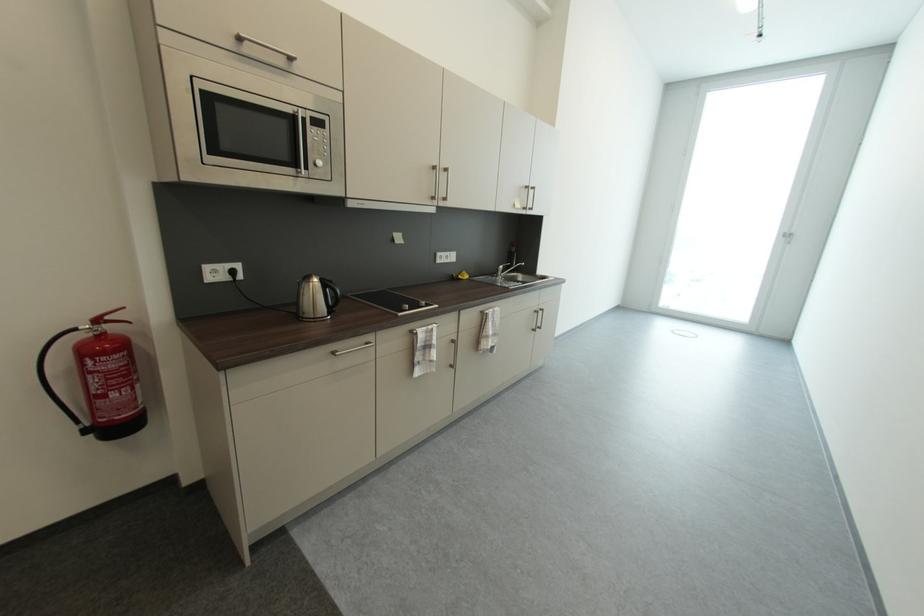
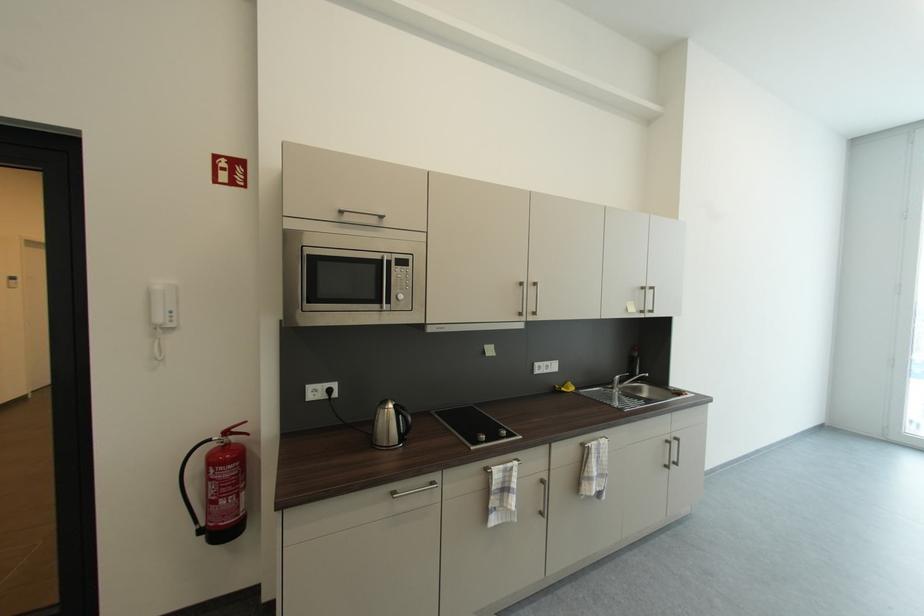
Find the pixel in the second image that matches the point at 325,281 in the first image.

(400, 407)